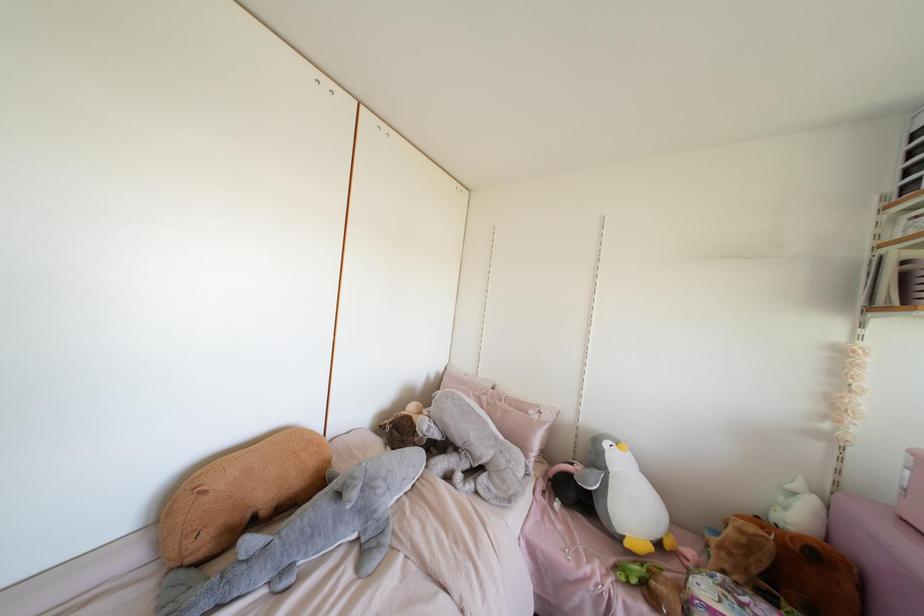
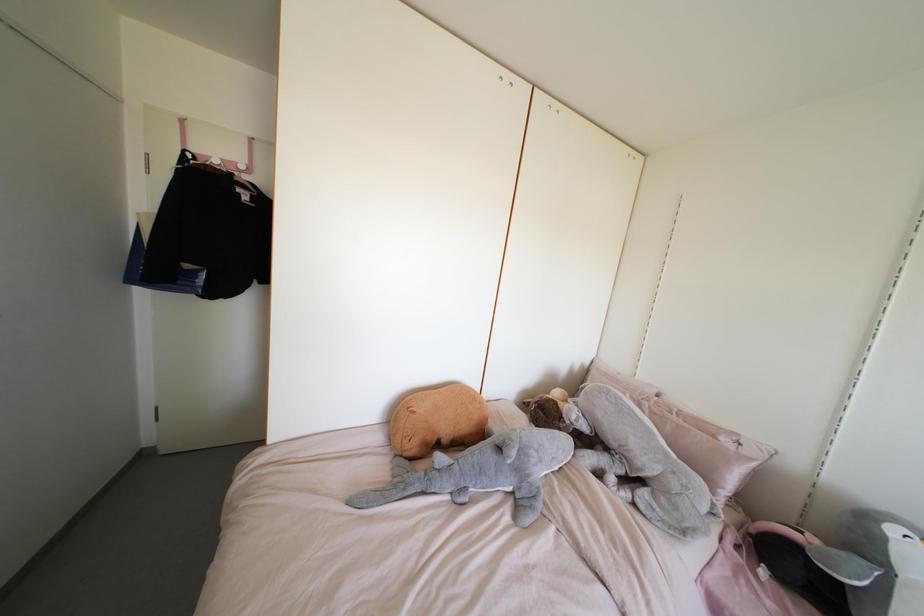
The images are taken continuously from a first-person perspective. In which direction are you moving?

The cameraman moved toward left, backward.